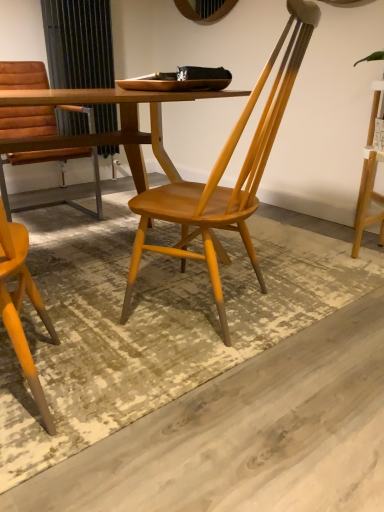
This screenshot has width=384, height=512. Describe the element at coordinates (61, 175) in the screenshot. I see `matte brown leather chair at left, which is the 1th chair from left to right` at that location.

The width and height of the screenshot is (384, 512). What do you see at coordinates (110, 132) in the screenshot?
I see `wooden table at center` at bounding box center [110, 132].

In order to click on matte brown leather chair at left, the 2th chair in the front-to-back sequence in this screenshot , I will do `click(61, 175)`.

Is wooden table at center taller or shorter than wooden chair at center, acting as the 1th chair starting from the right?

Considering their sizes, wooden table at center has less height than wooden chair at center, acting as the 1th chair starting from the right.

In the image, there is a wooden chair at center, arranged as the 2th chair when viewed from the back. At what (x,y) coordinates should I click in order to perform the action: click on table above it (from the image's perspective). Please return your answer as a coordinate pair (x, y). This screenshot has height=512, width=384. Looking at the image, I should click on (110, 132).

Is wooden table at center far from wooden chair at center, which is the first chair in front-to-back order?

No, wooden table at center is in close proximity to wooden chair at center, which is the first chair in front-to-back order.

Can we say matte brown leather chair at left, which is the 1th chair from left to right, lies outside wooden table at center?

That's correct, matte brown leather chair at left, which is the 1th chair from left to right, is outside of wooden table at center.

Is matte brown leather chair at left, acting as the 1th chair starting from the back, at the right side of wooden table at center?

No.

What's the angular difference between matte brown leather chair at left, acting as the 2th chair starting from the right, and wooden table at center's facing directions?

The angle between the facing direction of matte brown leather chair at left, acting as the 2th chair starting from the right, and the facing direction of wooden table at center is 1.28 degrees.

Could you tell me if matte brown leather chair at left, acting as the 2th chair starting from the right, is facing wooden table at center?

Yes, matte brown leather chair at left, acting as the 2th chair starting from the right, is facing wooden table at center.

Looking at this image, which is more to the right, wooden chair at center, which is the first chair in front-to-back order, or wooden table at center?

wooden chair at center, which is the first chair in front-to-back order.

From the image's perspective, is wooden chair at center, acting as the 1th chair starting from the right, above wooden table at center?

No, from the image's perspective, wooden chair at center, acting as the 1th chair starting from the right, is not over wooden table at center.

Between wooden chair at center, which is the first chair in front-to-back order, and wooden table at center, which one has less height?

With less height is wooden table at center.

Between wooden chair at center, which is the first chair in front-to-back order, and matte brown leather chair at left, which is the 1th chair from left to right, which one appears on the left side from the viewer's perspective?

matte brown leather chair at left, which is the 1th chair from left to right, is more to the left.

Consider the image. Considering the relative sizes of wooden chair at center, which is the first chair in front-to-back order, and matte brown leather chair at left, acting as the 2th chair starting from the right, in the image provided, is wooden chair at center, which is the first chair in front-to-back order, bigger than matte brown leather chair at left, acting as the 2th chair starting from the right,?

Actually, wooden chair at center, which is the first chair in front-to-back order, might be smaller than matte brown leather chair at left, acting as the 2th chair starting from the right.

Based on the photo, from the image's perspective, is wooden chair at center, placed as the 2th chair when sorted from left to right, located above matte brown leather chair at left, acting as the 2th chair starting from the right?

Incorrect, from the image's perspective, wooden chair at center, placed as the 2th chair when sorted from left to right, is lower than matte brown leather chair at left, acting as the 2th chair starting from the right.

From a real-world perspective, is wooden chair at center, placed as the 2th chair when sorted from left to right, beneath matte brown leather chair at left, which is the 1th chair from left to right?

No.

Is point (19, 156) positioned in front of point (212, 230)?

No, (19, 156) is behind (212, 230).

Considering the positions of objects matte brown leather chair at left, the 2th chair in the front-to-back sequence, and wooden chair at center, which is the first chair in front-to-back order, in the image provided, who is in front, matte brown leather chair at left, the 2th chair in the front-to-back sequence, or wooden chair at center, which is the first chair in front-to-back order,?

wooden chair at center, which is the first chair in front-to-back order.

Could you tell me if matte brown leather chair at left, acting as the 2th chair starting from the right, is turned towards wooden chair at center, arranged as the 2th chair when viewed from the back?

Yes, matte brown leather chair at left, acting as the 2th chair starting from the right, is aimed at wooden chair at center, arranged as the 2th chair when viewed from the back.

What's the angular difference between matte brown leather chair at left, which is the 1th chair from left to right, and wooden chair at center, placed as the 2th chair when sorted from left to right,'s facing directions?

The angle between the facing direction of matte brown leather chair at left, which is the 1th chair from left to right, and the facing direction of wooden chair at center, placed as the 2th chair when sorted from left to right, is 157 degrees.

Could you measure the distance between wooden table at center and matte brown leather chair at left, which is the 1th chair from left to right?

wooden table at center is 33.37 inches away from matte brown leather chair at left, which is the 1th chair from left to right.

From the image's perspective, is wooden table at center below matte brown leather chair at left, the 2th chair in the front-to-back sequence?

Correct, wooden table at center appears lower than matte brown leather chair at left, the 2th chair in the front-to-back sequence, in the image.

Do you think wooden table at center is within matte brown leather chair at left, acting as the 1th chair starting from the back, or outside of it?

wooden table at center is not enclosed by matte brown leather chair at left, acting as the 1th chair starting from the back.

Is wooden table at center with matte brown leather chair at left, acting as the 2th chair starting from the right?

No, wooden table at center is not touching matte brown leather chair at left, acting as the 2th chair starting from the right.

This screenshot has width=384, height=512. I want to click on table on the left of wooden chair at center, placed as the 2th chair when sorted from left to right, so click(110, 132).

The image size is (384, 512). I want to click on table in front of the matte brown leather chair at left, the 2th chair in the front-to-back sequence, so click(x=110, y=132).

Consider the image. Estimate the real-world distances between objects in this image. Which object is closer to matte brown leather chair at left, acting as the 2th chair starting from the right, wooden chair at center, placed as the 2th chair when sorted from left to right, or wooden table at center?

wooden table at center is positioned closer to the anchor matte brown leather chair at left, acting as the 2th chair starting from the right.

From the image, which object appears to be farther from wooden table at center, matte brown leather chair at left, acting as the 2th chair starting from the right, or wooden chair at center, which is the first chair in front-to-back order?

The object further to wooden table at center is matte brown leather chair at left, acting as the 2th chair starting from the right.

From the image, which object appears to be farther from wooden chair at center, acting as the 1th chair starting from the right, matte brown leather chair at left, the 2th chair in the front-to-back sequence, or wooden table at center?

matte brown leather chair at left, the 2th chair in the front-to-back sequence.

From the image, which object appears to be farther from wooden chair at center, arranged as the 2th chair when viewed from the back, wooden table at center or matte brown leather chair at left, which is the 1th chair from left to right?

matte brown leather chair at left, which is the 1th chair from left to right.

Which object lies nearer to the anchor point matte brown leather chair at left, acting as the 2th chair starting from the right, wooden table at center or wooden chair at center, which is the first chair in front-to-back order?

Among the two, wooden table at center is located nearer to matte brown leather chair at left, acting as the 2th chair starting from the right.

When comparing their distances from wooden table at center, does wooden chair at center, which is the first chair in front-to-back order, or matte brown leather chair at left, the 2th chair in the front-to-back sequence, seem closer?

Based on the image, wooden chair at center, which is the first chair in front-to-back order, appears to be nearer to wooden table at center.

Image resolution: width=384 pixels, height=512 pixels. Find the location of `table between wooden chair at center, placed as the 2th chair when sorted from left to right, and matte brown leather chair at left, the 2th chair in the front-to-back sequence, from front to back`. table between wooden chair at center, placed as the 2th chair when sorted from left to right, and matte brown leather chair at left, the 2th chair in the front-to-back sequence, from front to back is located at coordinates (110, 132).